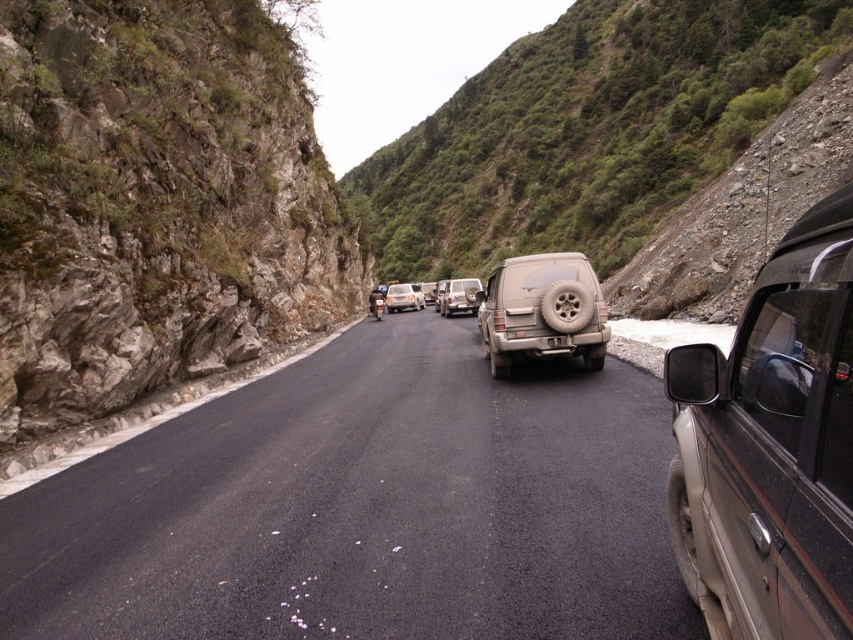
Question: Which object is closer to the camera taking this photo?

Choices:
 (A) matte black suv at right
 (B) asphalt road at left
 (C) metallic silver car at center

Answer: (A)

Question: Does asphalt road at left come behind metallic silver car at center?

Choices:
 (A) no
 (B) yes

Answer: (A)

Question: Does matte gray suv at center have a lesser width compared to matte silver jeep at center?

Choices:
 (A) yes
 (B) no

Answer: (A)

Question: Can you confirm if rocky cliff at left is bigger than matte silver jeep at center?

Choices:
 (A) no
 (B) yes

Answer: (A)

Question: Which point is farther to the camera?

Choices:
 (A) (759, 580)
 (B) (596, 449)
 (C) (154, 419)
 (D) (465, 307)

Answer: (D)

Question: Which point appears farthest from the camera in this image?

Choices:
 (A) (508, 72)
 (B) (260, 24)
 (C) (265, 371)

Answer: (A)